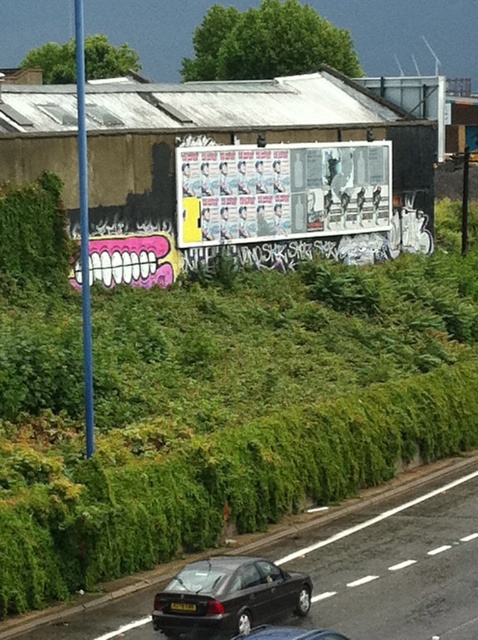
Question: Among these points, which one is nearest to the camera?

Choices:
 (A) (98, 472)
 (B) (180, 604)
 (C) (301, 20)
 (D) (286, 628)

Answer: (D)

Question: Among these points, which one is farthest from the camera?

Choices:
 (A) (178, 593)
 (B) (176, 604)
 (C) (349, 637)

Answer: (A)

Question: Does shiny black sedan at center appear over yellow matte license plate at center?

Choices:
 (A) no
 (B) yes

Answer: (B)

Question: Is green leafy hedge at upper center smaller than shiny black sedan at lower center?

Choices:
 (A) no
 (B) yes

Answer: (A)

Question: Observing the image, what is the correct spatial positioning of black car at lower center in reference to yellow matte license plate at center?

Choices:
 (A) left
 (B) right

Answer: (B)

Question: Which point is farther to the camera?

Choices:
 (A) (173, 611)
 (B) (184, 573)
 (C) (341, 636)
 (D) (230, 28)

Answer: (D)